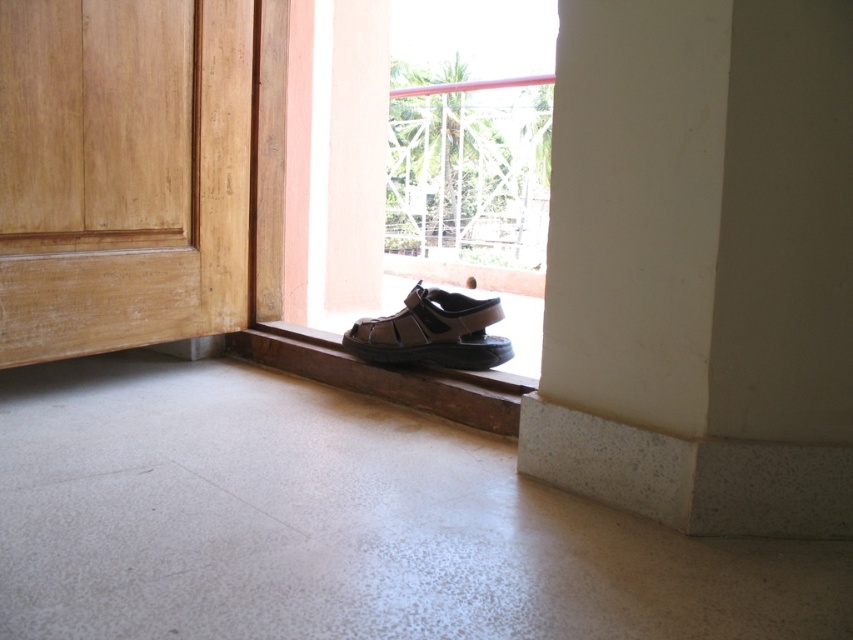
You are standing in the room and want to exit through the door. Which object is closer to the exit, the light brown wood door at lower left or the brown leather sandal at lower center?

The light brown wood door at lower left is closer to the exit because it is positioned to the left of the brown leather sandal at lower center, and the exit is through the door itself.